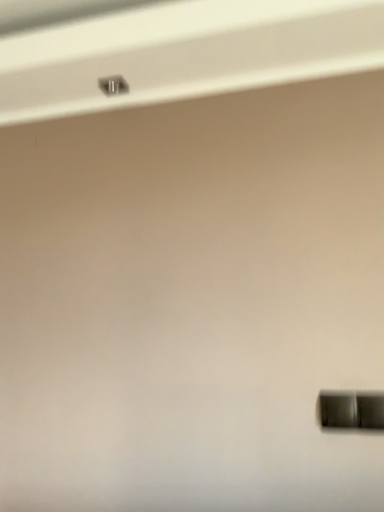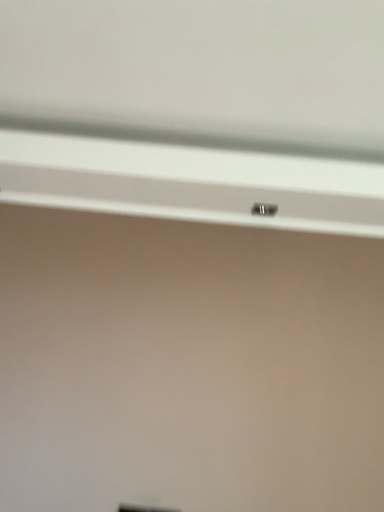
Question: Which way did the camera rotate in the video?

Choices:
 (A) rotated downward
 (B) rotated upward

Answer: (B)